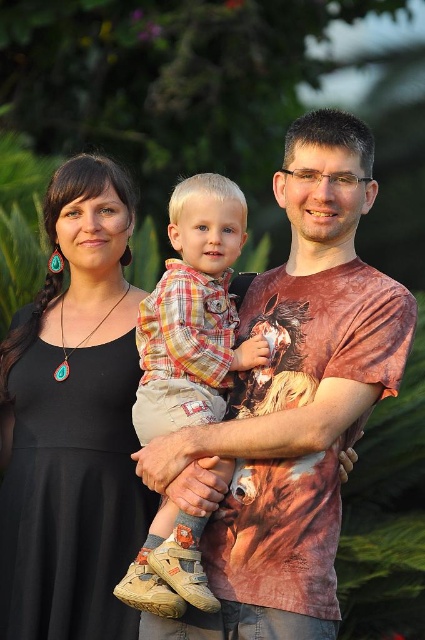
Question: Does matte brown t-shirt at center appear on the right side of black fabric dress at left?

Choices:
 (A) yes
 (B) no

Answer: (A)

Question: Which of the following is the closest to the observer?

Choices:
 (A) matte brown t-shirt at center
 (B) black fabric dress at left

Answer: (A)

Question: Can you confirm if matte brown t-shirt at center is smaller than black fabric dress at left?

Choices:
 (A) yes
 (B) no

Answer: (B)

Question: Can you confirm if matte brown t-shirt at center is bigger than plaid cotton shirt at center?

Choices:
 (A) yes
 (B) no

Answer: (A)

Question: Which of the following is the farthest from the observer?

Choices:
 (A) black fabric dress at left
 (B) plaid cotton shirt at center
 (C) matte brown t-shirt at center

Answer: (A)

Question: Which of the following is the closest to the observer?

Choices:
 (A) [153, 294]
 (B) [50, 312]

Answer: (A)